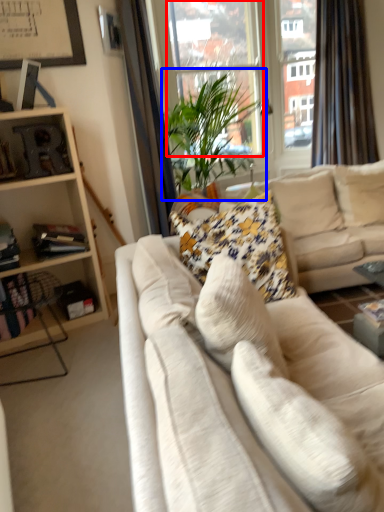
Question: Which point is closer to the camera, window screen (highlighted by a red box) or houseplant (highlighted by a blue box)?

Choices:
 (A) window screen
 (B) houseplant

Answer: (B)